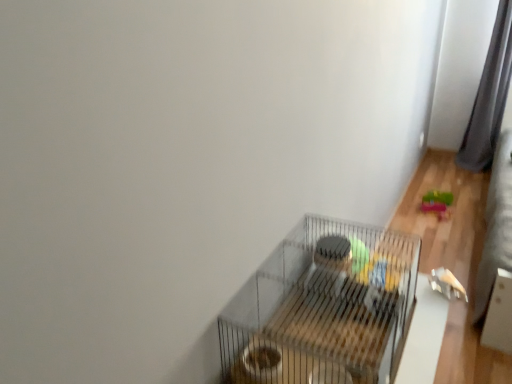
What do you see at coordinates (437, 203) in the screenshot? Image resolution: width=512 pixels, height=384 pixels. I see `rubberized green toy at lower right` at bounding box center [437, 203].

This screenshot has width=512, height=384. What do you see at coordinates (489, 96) in the screenshot?
I see `gray fabric curtain at right` at bounding box center [489, 96].

Identify the location of gray fabric curtain at right. 489,96.

Locate an element on the screen. The width and height of the screenshot is (512, 384). rubberized green toy at lower right is located at coordinates (437, 203).

Which of these two, metallic wire birdcage at center or gray fabric curtain at right, is smaller?

metallic wire birdcage at center is smaller.

From a real-world perspective, which object rests below the other?

metallic wire birdcage at center.

Which is behind, point (336, 289) or point (484, 84)?

The point (484, 84) is farther from the camera.

Considering the relative positions of metallic wire birdcage at center and gray fabric curtain at right in the image provided, is metallic wire birdcage at center behind gray fabric curtain at right?

No, metallic wire birdcage at center is in front of gray fabric curtain at right.

From the image's perspective, is rubberized green toy at lower right above gray fabric curtain at right?

No.

Which is closer, (423, 207) or (510, 9)?

Point (423, 207) appears to be closer to the viewer than point (510, 9).

What's the angular difference between rubberized green toy at lower right and gray fabric curtain at right's facing directions?

88.7 degrees separate the facing orientations of rubberized green toy at lower right and gray fabric curtain at right.

Considering the relative sizes of rubberized green toy at lower right and gray fabric curtain at right in the image provided, is rubberized green toy at lower right wider than gray fabric curtain at right?

No.

Could you tell me if metallic wire birdcage at center is facing rubberized green toy at lower right?

No.

Who is more distant, metallic wire birdcage at center or rubberized green toy at lower right?

Positioned behind is rubberized green toy at lower right.

Does metallic wire birdcage at center have a greater width compared to rubberized green toy at lower right?

Yes.

Measure the distance between metallic wire birdcage at center and rubberized green toy at lower right.

6.27 feet.

Where is `toy below the gray fabric curtain at right (from a real-world perspective)`? toy below the gray fabric curtain at right (from a real-world perspective) is located at coordinates (437, 203).

Is gray fabric curtain at right positioned with its back to rubberized green toy at lower right?

gray fabric curtain at right is not turned away from rubberized green toy at lower right.

How many degrees apart are the facing directions of gray fabric curtain at right and rubberized green toy at lower right?

88.7 degrees separate the facing orientations of gray fabric curtain at right and rubberized green toy at lower right.

Would you say gray fabric curtain at right is to the left or to the right of rubberized green toy at lower right in the picture?

Clearly, gray fabric curtain at right is on the right of rubberized green toy at lower right in the image.

Based on their positions, is gray fabric curtain at right located to the left or right of metallic wire birdcage at center?

gray fabric curtain at right is positioned on metallic wire birdcage at center's right side.

Is gray fabric curtain at right bigger than metallic wire birdcage at center?

Correct, gray fabric curtain at right is larger in size than metallic wire birdcage at center.

From a real-world perspective, between gray fabric curtain at right and metallic wire birdcage at center, who is vertically lower?

metallic wire birdcage at center.

From a real-world perspective, relative to metallic wire birdcage at center, is rubberized green toy at lower right vertically above or below?

From a real-world perspective, rubberized green toy at lower right is physically below metallic wire birdcage at center.

The height and width of the screenshot is (384, 512). Identify the location of toy above the metallic wire birdcage at center (from the image's perspective). (437, 203).

From the image's perspective, is rubberized green toy at lower right located above metallic wire birdcage at center?

Yes, from the image's perspective, rubberized green toy at lower right is above metallic wire birdcage at center.

The image size is (512, 384). Find the location of `bird cage on the left of gray fabric curtain at right`. bird cage on the left of gray fabric curtain at right is located at coordinates (323, 307).

This screenshot has width=512, height=384. I want to click on curtain that is behind the rubberized green toy at lower right, so click(x=489, y=96).

When comparing their distances from rubberized green toy at lower right, does gray fabric curtain at right or metallic wire birdcage at center seem further?

metallic wire birdcage at center is positioned further to the anchor rubberized green toy at lower right.

Looking at the image, which one is located closer to metallic wire birdcage at center, gray fabric curtain at right or rubberized green toy at lower right?

rubberized green toy at lower right is positioned closer to the anchor metallic wire birdcage at center.

Looking at the image, which one is located closer to rubberized green toy at lower right, metallic wire birdcage at center or gray fabric curtain at right?

Based on the image, gray fabric curtain at right appears to be nearer to rubberized green toy at lower right.

When comparing their distances from gray fabric curtain at right, does metallic wire birdcage at center or rubberized green toy at lower right seem further?

metallic wire birdcage at center is positioned further to the anchor gray fabric curtain at right.

From the image, which object appears to be nearer to metallic wire birdcage at center, rubberized green toy at lower right or gray fabric curtain at right?

Based on the image, rubberized green toy at lower right appears to be nearer to metallic wire birdcage at center.

Looking at the image, which one is located closer to gray fabric curtain at right, rubberized green toy at lower right or metallic wire birdcage at center?

Among the two, rubberized green toy at lower right is located nearer to gray fabric curtain at right.

Find the location of a particular element. toy between metallic wire birdcage at center and gray fabric curtain at right along the z-axis is located at coordinates (437, 203).